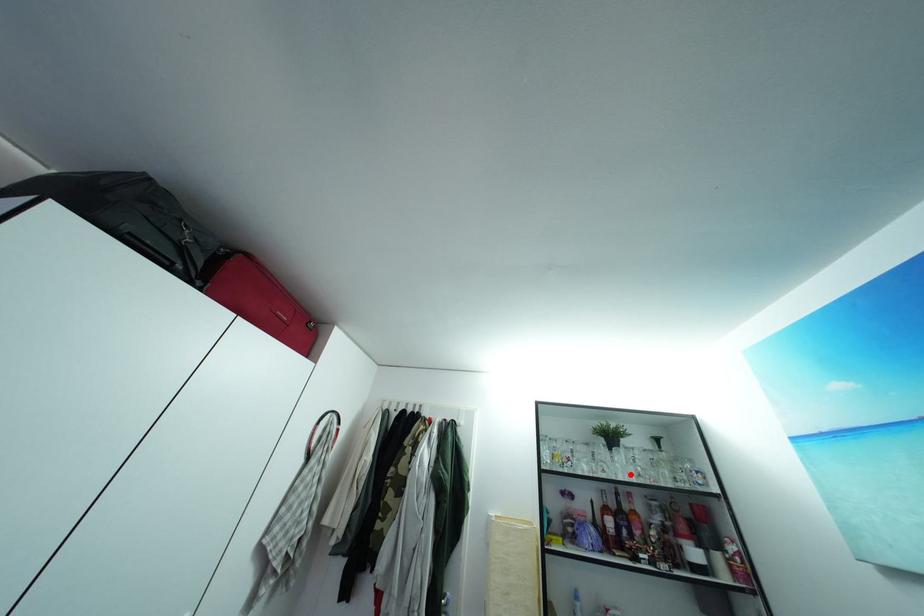
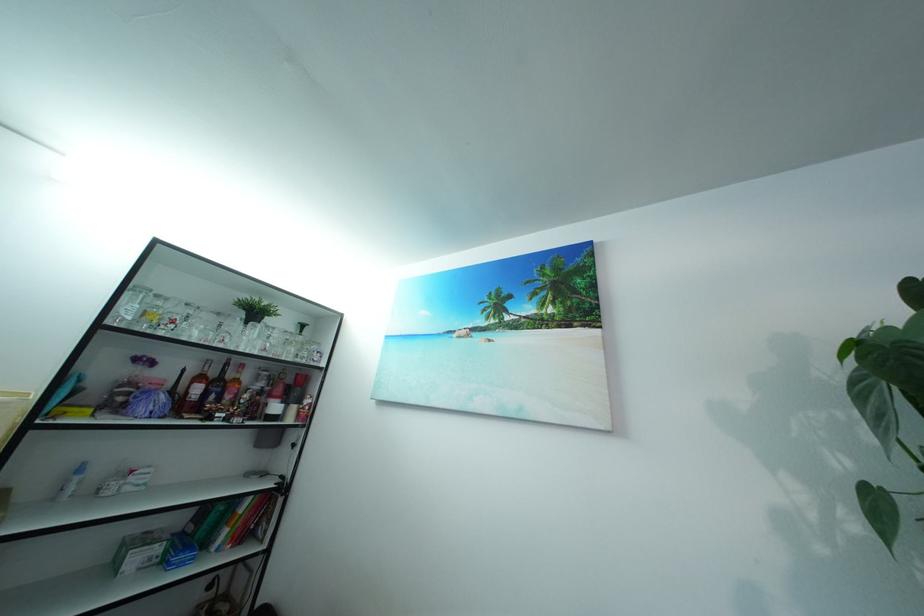
Locate, in the second image, the point that corresponds to the highlighted location in the first image.

(257, 347)